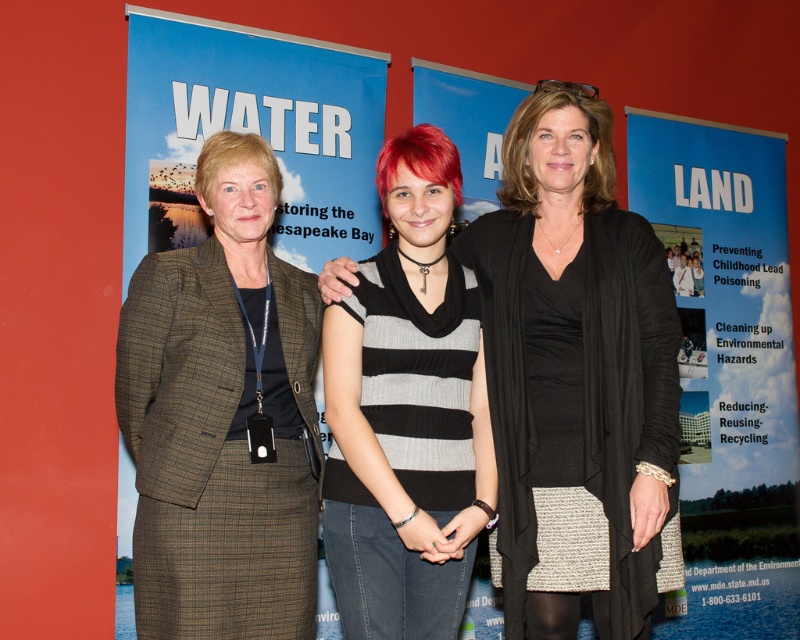
You are a photographer standing in front of the red wall. You want to take a photo that includes both the black knit sweater at center and the striped sweater at center. Which sweater should you focus on to ensure both are in the frame?

The black knit sweater at center is much taller than the striped sweater at center, so focusing on the black knit sweater at center would ensure both are in the frame as it occupies more vertical space.